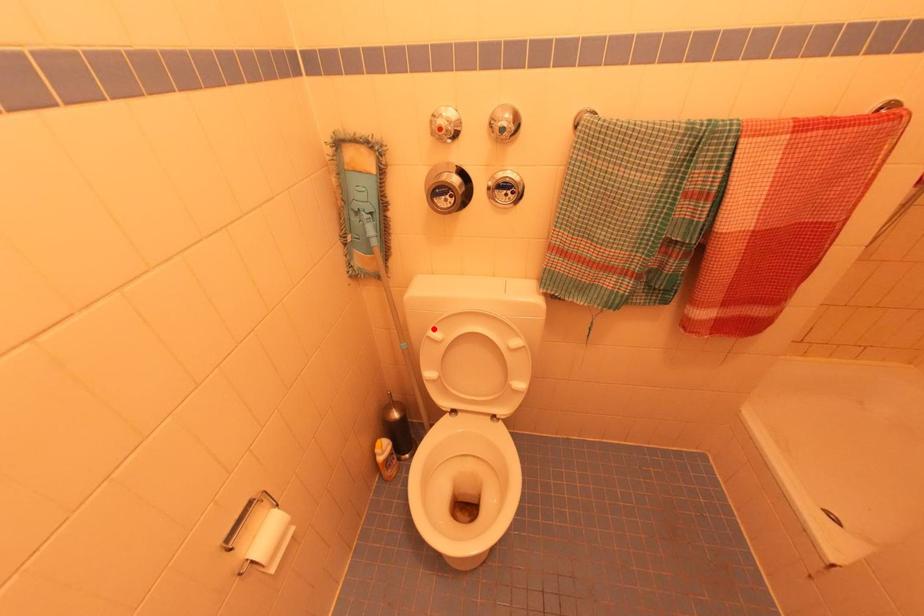
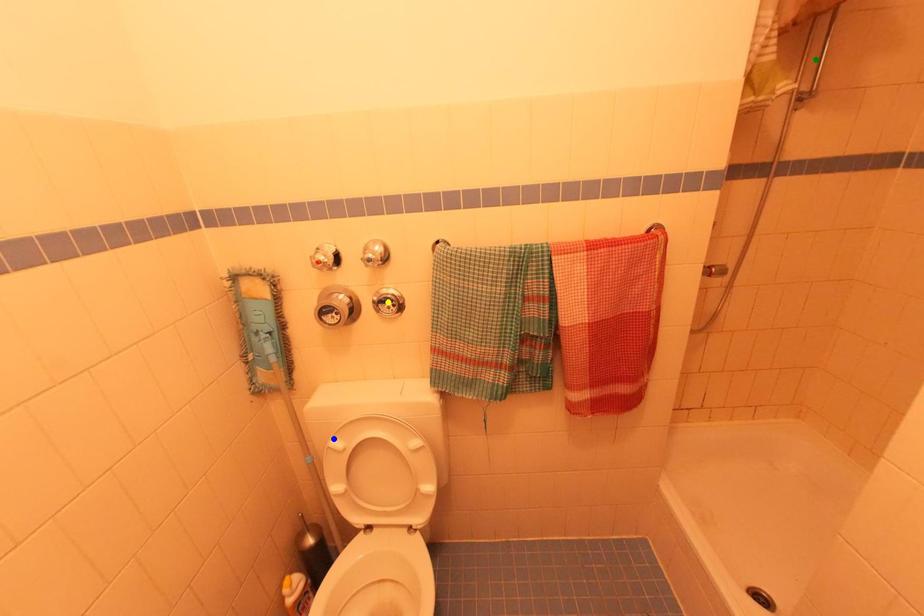
Question: I am providing you with two images of the same scene from different viewpoints. A red point is marked on the first image. You are given multiple points on the second image. Which mark in image 2 goes with the point in image 1?

Choices:
 (A) blue point
 (B) green point
 (C) yellow point

Answer: (A)